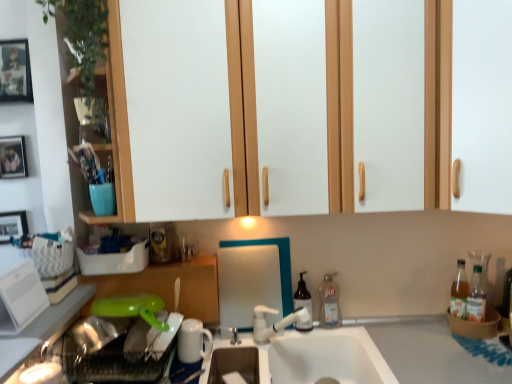
Question: Does translucent plastic soap dispenser at center, which is counted as the second bottle, starting from the right, have a lesser width compared to clear plastic bottle at sink right, placed as the 1th bottle when sorted from right to left?

Choices:
 (A) yes
 (B) no

Answer: (B)

Question: From a real-world perspective, is translucent plastic soap dispenser at center, placed as the 1th bottle when sorted from left to right, beneath clear plastic bottle at sink right, the 2th bottle in the left-to-right sequence?

Choices:
 (A) no
 (B) yes

Answer: (A)

Question: Is translucent plastic soap dispenser at center, which is counted as the second bottle, starting from the right, further to camera compared to clear plastic bottle at sink right, placed as the 1th bottle when sorted from right to left?

Choices:
 (A) no
 (B) yes

Answer: (A)

Question: Does translucent plastic soap dispenser at center, placed as the 1th bottle when sorted from left to right, contain clear plastic bottle at sink right, the 2th bottle in the left-to-right sequence?

Choices:
 (A) no
 (B) yes

Answer: (A)

Question: Is translucent plastic soap dispenser at center, which is counted as the second bottle, starting from the right, at the left side of clear plastic bottle at sink right, the 2th bottle in the left-to-right sequence?

Choices:
 (A) no
 (B) yes

Answer: (B)

Question: Considering their positions, is translucent plastic soap dispenser at center, which is counted as the second bottle, starting from the right, located in front of or behind green plastic dish washer at lower left?

Choices:
 (A) front
 (B) behind

Answer: (B)

Question: From their relative heights in the image, would you say translucent plastic soap dispenser at center, which is counted as the second bottle, starting from the right, is taller or shorter than green plastic dish washer at lower left?

Choices:
 (A) tall
 (B) short

Answer: (A)

Question: From the image's perspective, is translucent plastic soap dispenser at center, placed as the 1th bottle when sorted from left to right, located above or below green plastic dish washer at lower left?

Choices:
 (A) above
 (B) below

Answer: (A)

Question: In terms of width, does translucent plastic soap dispenser at center, placed as the 1th bottle when sorted from left to right, look wider or thinner when compared to green plastic dish washer at lower left?

Choices:
 (A) thin
 (B) wide

Answer: (A)

Question: Is green plastic lid at lower left, positioned as the first cabinetry in left-to-right order, taller or shorter than green plastic dish washer at lower left?

Choices:
 (A) tall
 (B) short

Answer: (A)

Question: Relative to green plastic dish washer at lower left, is green plastic lid at lower left, positioned as the first cabinetry in left-to-right order, in front or behind?

Choices:
 (A) front
 (B) behind

Answer: (B)

Question: Do you think green plastic lid at lower left, placed as the 2th cabinetry when sorted from right to left, is within green plastic dish washer at lower left, or outside of it?

Choices:
 (A) outside
 (B) inside

Answer: (A)

Question: Considering the positions of point (168, 271) and point (108, 319), is point (168, 271) closer or farther from the camera than point (108, 319)?

Choices:
 (A) closer
 (B) farther

Answer: (B)

Question: Based on their sizes in the image, would you say wooden framed picture at left, the 1th picture frame when ordered from bottom to top, is bigger or smaller than metallic photo frame at upper left, the 2th picture frame when ordered from back to front?

Choices:
 (A) small
 (B) big

Answer: (B)

Question: Would you say wooden framed picture at left, the 3th picture frame in the top-to-bottom sequence, is to the left or to the right of metallic photo frame at upper left, the 2th picture frame when ordered from back to front, in the picture?

Choices:
 (A) right
 (B) left

Answer: (B)